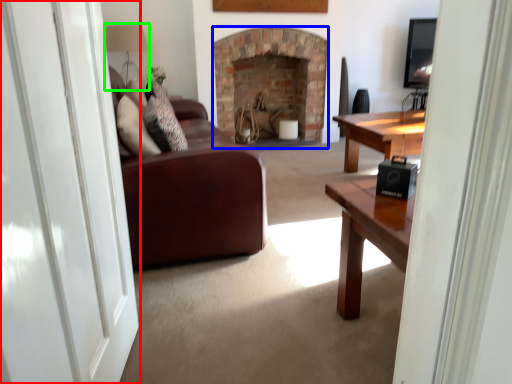
Question: Which object is positioned farthest from screen door (highlighted by a red box)? Select from fireplace (highlighted by a blue box) and lamp (highlighted by a green box).

Choices:
 (A) fireplace
 (B) lamp

Answer: (A)